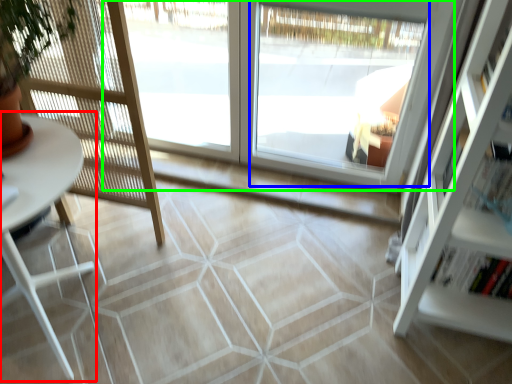
Question: Based on their relative distances, which object is nearer to table (highlighted by a red box)? Choose from window (highlighted by a blue box) and window (highlighted by a green box).

Choices:
 (A) window
 (B) window

Answer: (B)